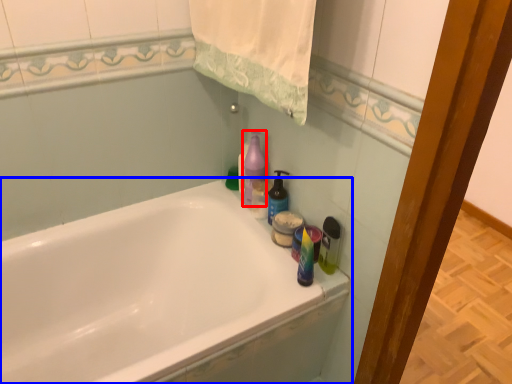
Question: Which point is closer to the camera, cleaning product (highlighted by a red box) or bathtub (highlighted by a blue box)?

Choices:
 (A) cleaning product
 (B) bathtub

Answer: (B)